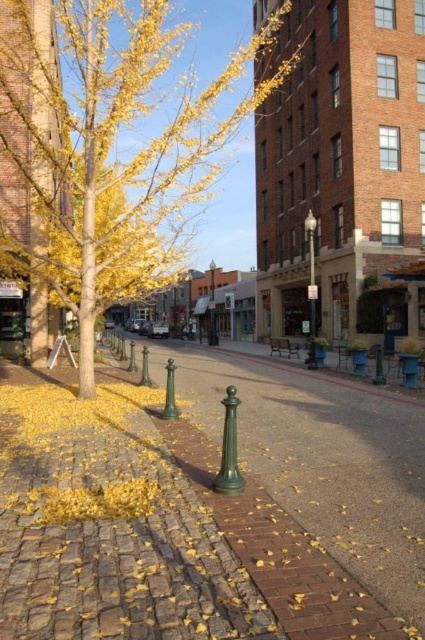
Who is taller, yellow leafy tree at center or green metallic lamp post at center?

Standing taller between the two is yellow leafy tree at center.

The image size is (425, 640). Find the location of `yellow leafy tree at center`. yellow leafy tree at center is located at coordinates (110, 147).

The image size is (425, 640). Describe the element at coordinates (110, 147) in the screenshot. I see `yellow leafy tree at center` at that location.

Is point (82, 40) positioned before point (311, 237)?

Yes, it is.

Is point (268, 52) farther from viewer compared to point (311, 323)?

That is True.

This screenshot has width=425, height=640. I want to click on yellow leafy tree at center, so click(x=110, y=147).

Consider the image. Between yellow leafy tree at center and brick pavement at center, which one is positioned higher?

yellow leafy tree at center is higher up.

Can you confirm if yellow leafy tree at center is positioned to the left of brick pavement at center?

Yes, yellow leafy tree at center is to the left of brick pavement at center.

Locate an element on the screen. yellow leafy tree at center is located at coordinates (110, 147).